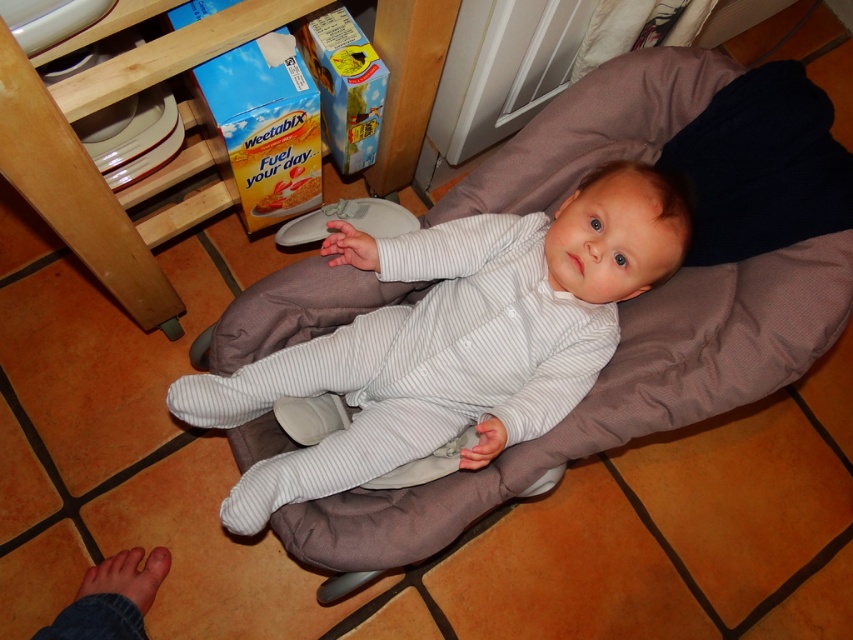
You are a photographer setting up for a baby photo shoot. You have a gray fabric baby seat at center and a gray striped onesie at center in the scene. Which object is taller?

The gray fabric baby seat at center is much taller than the gray striped onesie at center.

You are a photographer setting up for a baby photoshoot. You have a gray fabric baby seat at center and a gray striped onesie at center in the scene. Based on their positions, which object is located to the right of the other?

The gray fabric baby seat at center is to the right of the gray striped onesie at center.

From the picture: You are taking a photo of the baby and want to focus on the point closest to the camera. Which point should you choose between point (303,264) and point (640,275)?

Point (303,264) is further to the camera than point (640,275), so you should choose point (303,264) to focus on the point closest to the camera.